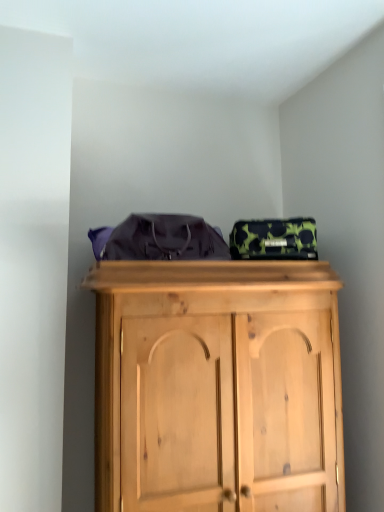
Question: Is camouflage-patterned fabric bag at upper center taller than matte purple bag at center?

Choices:
 (A) yes
 (B) no

Answer: (B)

Question: Is camouflage-patterned fabric bag at upper center positioned in front of matte purple bag at center?

Choices:
 (A) yes
 (B) no

Answer: (B)

Question: Is camouflage-patterned fabric bag at upper center positioned with its back to matte purple bag at center?

Choices:
 (A) no
 (B) yes

Answer: (A)

Question: Is camouflage-patterned fabric bag at upper center far away from matte purple bag at center?

Choices:
 (A) no
 (B) yes

Answer: (A)

Question: Is camouflage-patterned fabric bag at upper center bigger than matte purple bag at center?

Choices:
 (A) no
 (B) yes

Answer: (A)

Question: Considering the relative sizes of camouflage-patterned fabric bag at upper center and matte purple bag at center in the image provided, is camouflage-patterned fabric bag at upper center wider than matte purple bag at center?

Choices:
 (A) no
 (B) yes

Answer: (A)

Question: Does matte purple bag at center turn towards camouflage-patterned fabric bag at upper center?

Choices:
 (A) no
 (B) yes

Answer: (A)

Question: From the image's perspective, is matte purple bag at center under camouflage-patterned fabric bag at upper center?

Choices:
 (A) yes
 (B) no

Answer: (B)

Question: Is matte purple bag at center next to camouflage-patterned fabric bag at upper center and touching it?

Choices:
 (A) no
 (B) yes

Answer: (A)

Question: Considering the relative sizes of matte purple bag at center and camouflage-patterned fabric bag at upper center in the image provided, is matte purple bag at center thinner than camouflage-patterned fabric bag at upper center?

Choices:
 (A) yes
 (B) no

Answer: (B)

Question: Does matte purple bag at center appear on the right side of camouflage-patterned fabric bag at upper center?

Choices:
 (A) no
 (B) yes

Answer: (A)

Question: Does matte purple bag at center have a greater width compared to camouflage-patterned fabric bag at upper center?

Choices:
 (A) yes
 (B) no

Answer: (A)

Question: In terms of size, does matte purple bag at center appear bigger or smaller than camouflage-patterned fabric bag at upper center?

Choices:
 (A) big
 (B) small

Answer: (A)